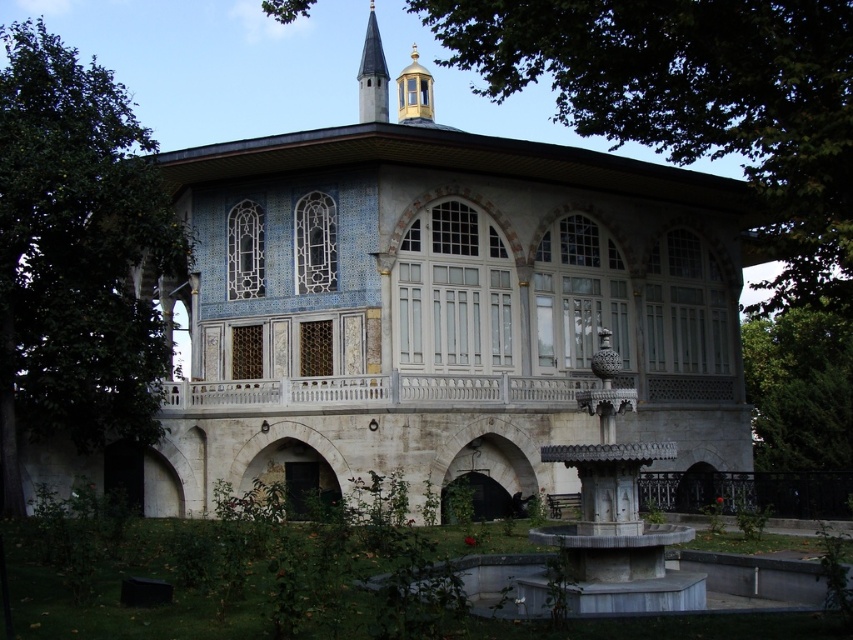
Question: Does green leafy tree at left appear over green leafy tree at right?

Choices:
 (A) yes
 (B) no

Answer: (A)

Question: Can you confirm if green leafy tree at left is thinner than smooth white spire at upper center?

Choices:
 (A) yes
 (B) no

Answer: (B)

Question: Estimate the real-world distances between objects in this image. Which object is closer to the white stone building at center?

Choices:
 (A) green leafy tree at right
 (B) green leafy tree at left
 (C) smooth white spire at upper center

Answer: (B)

Question: Can you confirm if white stone building at center is positioned to the left of green leafy tree at right?

Choices:
 (A) yes
 (B) no

Answer: (A)

Question: Which point is closer to the camera?

Choices:
 (A) green leafy tree at right
 (B) smooth white spire at upper center
 (C) white stone building at center

Answer: (A)

Question: Which point is farther to the camera?

Choices:
 (A) (119, 324)
 (B) (787, 480)
 (C) (670, 230)
 (D) (376, 84)

Answer: (D)